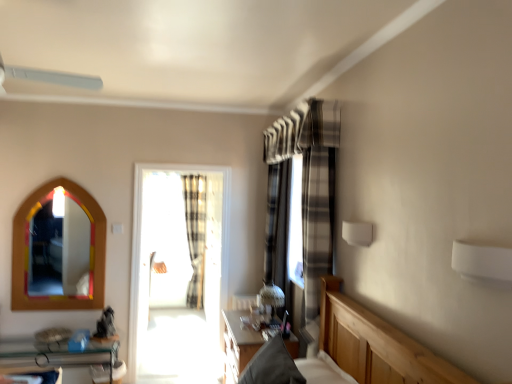
Question: Does point [192, 213] appear closer or farther from the camera than point [13, 339]?

Choices:
 (A) farther
 (B) closer

Answer: (A)

Question: From the image's perspective, is plaid fabric curtain at center, which ranks as the second curtain in right-to-left order, located above or below clear glass shelf at lower left?

Choices:
 (A) below
 (B) above

Answer: (B)

Question: Estimate the real-world distances between objects in this image. Which object is farther from the plaid fabric curtain at center, the first curtain in the right-to-left sequence?

Choices:
 (A) multicolored wooden mirror at left
 (B) clear glass shelf at lower left
 (C) wooden table at center
 (D) white plastic fan at upper left
 (E) translucent glass window at center

Answer: (E)

Question: Based on their relative distances, which object is nearer to the clear glass shelf at lower left?

Choices:
 (A) white plastic fan at upper left
 (B) multicolored wooden mirror at left
 (C) wooden table at center
 (D) plaid fabric curtain at center, acting as the 1th curtain starting from the front
 (E) plaid fabric curtain at center, the 2th curtain viewed from the front

Answer: (B)